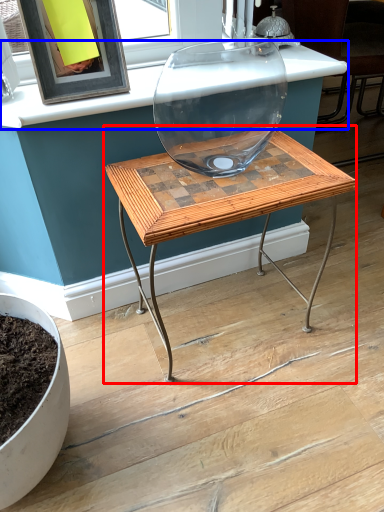
Question: Which of the following is the closest to the observer, table (highlighted by a red box) or counter top (highlighted by a blue box)?

Choices:
 (A) table
 (B) counter top

Answer: (A)